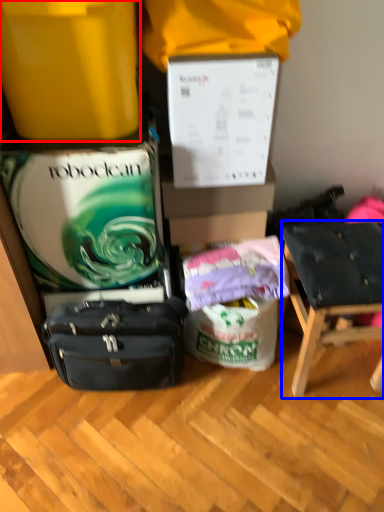
Question: Which of the following is the farthest to the observer, box (highlighted by a red box) or chair (highlighted by a blue box)?

Choices:
 (A) box
 (B) chair

Answer: (B)